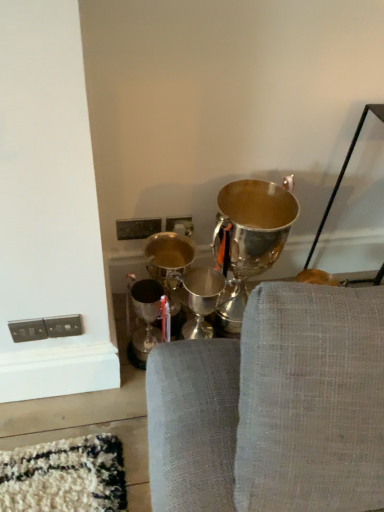
Locate an element on the screen. This screenshot has width=384, height=512. shiny silver trophy at center is located at coordinates (x=251, y=237).

Measure the distance between point (294, 215) and camera.

They are 1.25 meters apart.

What do you see at coordinates (251, 237) in the screenshot? I see `shiny silver trophy at center` at bounding box center [251, 237].

I want to click on shiny silver trophy at center, so click(x=251, y=237).